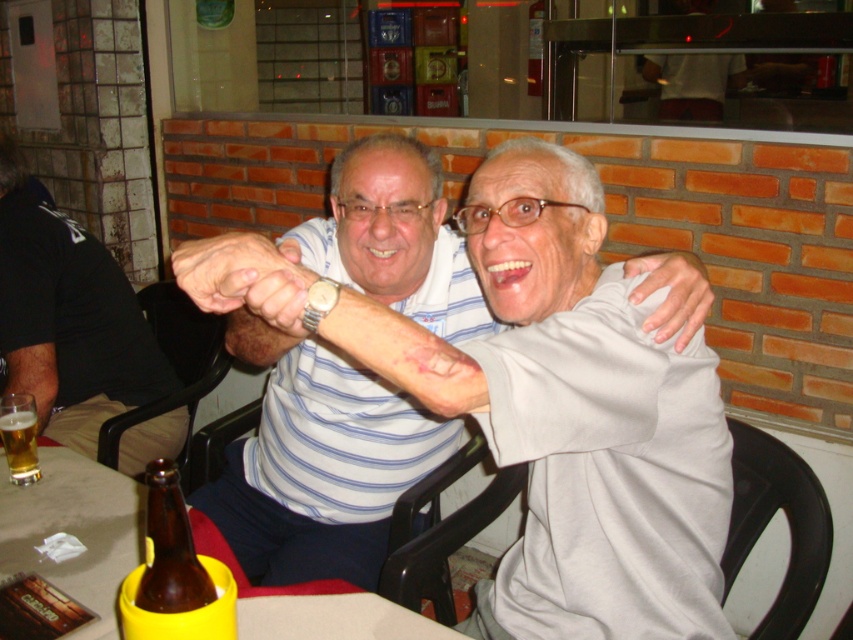
You are taking a photo of the two people holding hands at the table. You want to focus on the person on the left wearing the horizontally striped shirt. Which of the two points, point (49, 579) or point (160, 600), is closer to the camera and should you focus on it to ensure the person on the left is in sharp focus?

Point (49, 579) is further to the camera than point (160, 600), so you should focus on point (49, 579) to ensure the person on the left is in sharp focus.

You are a photographer setting up for a portrait. You notice the matte black shirt at left and the translucent glass mug at table left. Which object is taller when viewed from the photographer perspective?

The matte black shirt at left is taller than the translucent glass mug at table left according to the description.

You are a photographer trying to capture a closeup shot of the two people holding hands. You notice two points marked in the scene. Which point is closer to you, point (96,403) or point (155,504)?

Point (96,403) is closer to you than point (155,504).